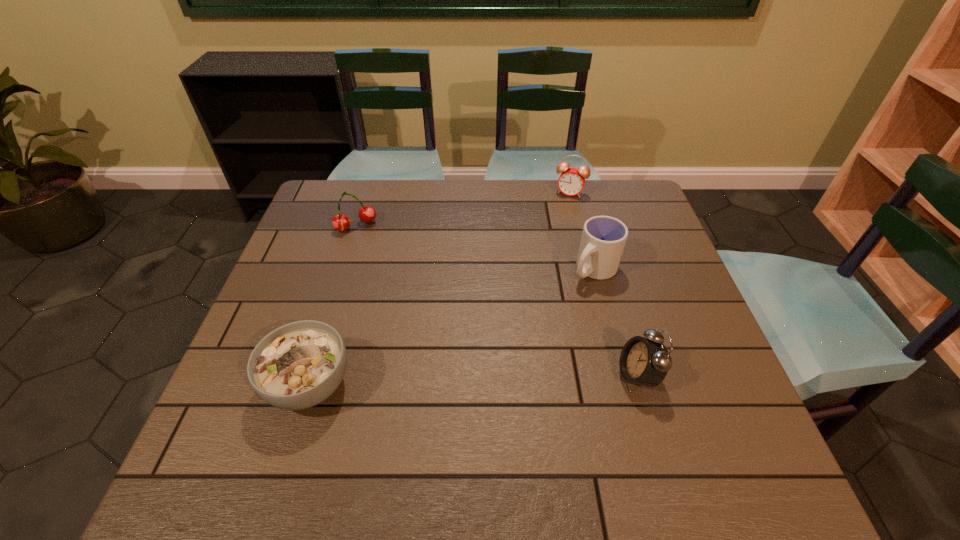
The height and width of the screenshot is (540, 960). Identify the location of vacant space on the desktop that is between the soup bowl and the nearer alarm clock and is positioned with the handle on the side of the third nearest object. (459, 380).

What are the coordinates of `vacant space on the desktop that is between the soup bowl and the nearer alarm clock and is positioned on the clock face of the farther alarm clock` in the screenshot? It's located at (495, 380).

Locate an element on the screen. vacant spot on the desktop that is between the soup bowl and the nearer alarm clock and is positioned with stems pointing upwards on the cherry is located at coordinates (442, 381).